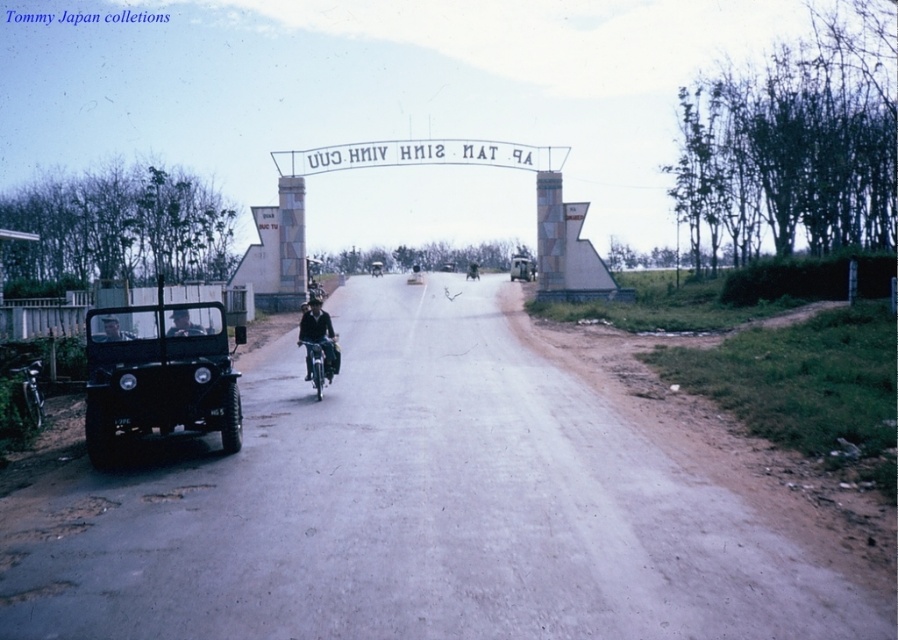
Can you confirm if matte black jeep at left is taller than white fabric banner at center?

In fact, matte black jeep at left may be shorter than white fabric banner at center.

Who is lower down, matte black jeep at left or white fabric banner at center?

matte black jeep at left

Is point (186, 426) less distant than point (324, 164)?

Yes, it is in front of point (324, 164).

Where is `matte black jeep at left`? The image size is (898, 640). matte black jeep at left is located at coordinates (157, 380).

In the scene shown: Is dark blue uniform at left taller than matte black jeep at center?

In fact, dark blue uniform at left may be shorter than matte black jeep at center.

Does dark blue uniform at left lie behind matte black jeep at center?

No, it is in front of matte black jeep at center.

Is point (119, 328) closer to camera compared to point (515, 269)?

Yes, point (119, 328) is in front of point (515, 269).

Where is `dark blue uniform at left`? The height and width of the screenshot is (640, 898). dark blue uniform at left is located at coordinates (112, 330).

Which is more to the left, white fabric banner at center or dark blue uniform at center?

dark blue uniform at center is more to the left.

Who is shorter, white fabric banner at center or dark blue uniform at center?

dark blue uniform at center

The height and width of the screenshot is (640, 898). What do you see at coordinates (419, 156) in the screenshot? I see `white fabric banner at center` at bounding box center [419, 156].

The height and width of the screenshot is (640, 898). I want to click on white fabric banner at center, so click(419, 156).